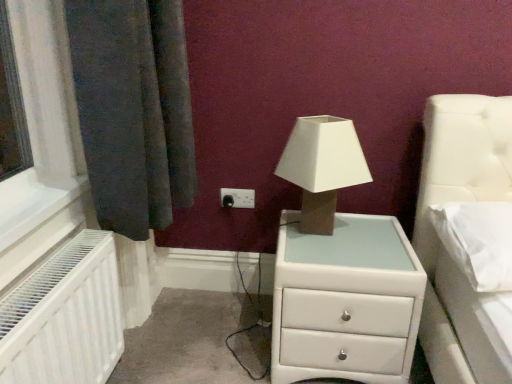
Question: Is white soft pillow at right surrounded by white glossy chest of drawers at center?

Choices:
 (A) no
 (B) yes

Answer: (A)

Question: Is white glossy chest of drawers at center to the left of white soft pillow at right from the viewer's perspective?

Choices:
 (A) no
 (B) yes

Answer: (B)

Question: From a real-world perspective, is white glossy chest of drawers at center over white soft pillow at right?

Choices:
 (A) yes
 (B) no

Answer: (B)

Question: Considering the relative sizes of white glossy chest of drawers at center and white soft pillow at right in the image provided, is white glossy chest of drawers at center wider than white soft pillow at right?

Choices:
 (A) yes
 (B) no

Answer: (A)

Question: Does white glossy chest of drawers at center appear on the right side of white soft pillow at right?

Choices:
 (A) no
 (B) yes

Answer: (A)

Question: From the image's perspective, is white plastic electric outlet at center positioned above or below white glossy chest of drawers at center?

Choices:
 (A) above
 (B) below

Answer: (A)

Question: Considering the positions of white plastic electric outlet at center and white glossy chest of drawers at center in the image, is white plastic electric outlet at center wider or thinner than white glossy chest of drawers at center?

Choices:
 (A) thin
 (B) wide

Answer: (A)

Question: From a real-world perspective, is white plastic electric outlet at center positioned above or below white glossy chest of drawers at center?

Choices:
 (A) above
 (B) below

Answer: (A)

Question: In terms of size, does white plastic electric outlet at center appear bigger or smaller than white glossy chest of drawers at center?

Choices:
 (A) big
 (B) small

Answer: (B)

Question: Based on their positions, is white soft pillow at right located to the left or right of matte beige cardboard at center?

Choices:
 (A) right
 (B) left

Answer: (A)

Question: Based on their sizes in the image, would you say white soft pillow at right is bigger or smaller than matte beige cardboard at center?

Choices:
 (A) small
 (B) big

Answer: (A)

Question: In terms of height, does white soft pillow at right look taller or shorter compared to matte beige cardboard at center?

Choices:
 (A) short
 (B) tall

Answer: (A)

Question: From a real-world perspective, is white soft pillow at right positioned above or below matte beige cardboard at center?

Choices:
 (A) above
 (B) below

Answer: (B)

Question: Is white glossy chest of drawers at center inside the boundaries of white plastic electric outlet at center, or outside?

Choices:
 (A) inside
 (B) outside

Answer: (B)

Question: Looking at their shapes, would you say white glossy chest of drawers at center is wider or thinner than white plastic electric outlet at center?

Choices:
 (A) thin
 (B) wide

Answer: (B)